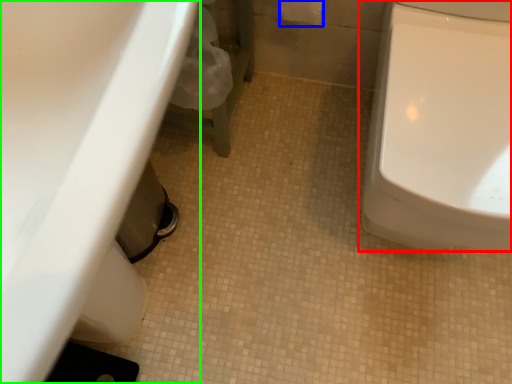
Question: Which is nearer to the toilet (highlighted by a red box)? toilet paper (highlighted by a blue box) or sink (highlighted by a green box).

Choices:
 (A) toilet paper
 (B) sink

Answer: (A)